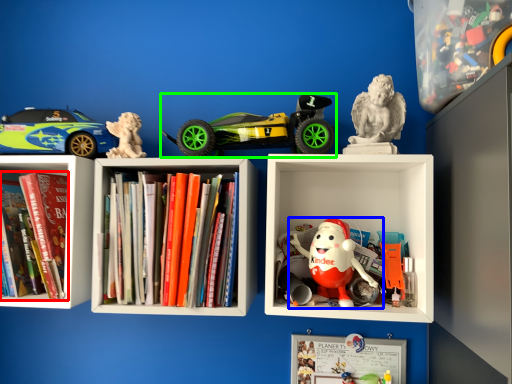
Question: Which is nearer to the book (highlighted by a red box)? toy (highlighted by a blue box) or toy (highlighted by a green box).

Choices:
 (A) toy
 (B) toy

Answer: (B)